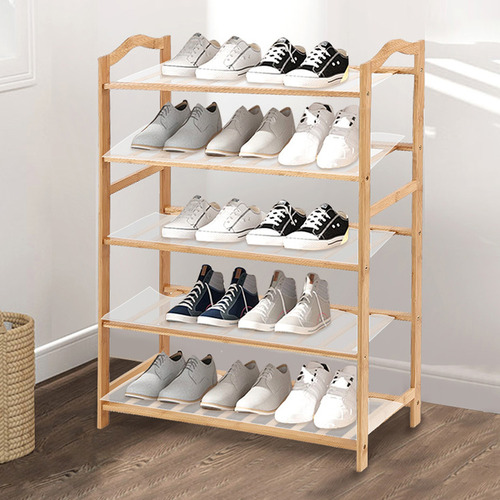
You are a GUI agent. You are given a task and a screenshot of the screen. Output one action in this format:
    pyautogui.click(x=<x>, y=<y>)
    Task: Click on the white shoes on a shelf
    
    Given the screenshot: What is the action you would take?
    pyautogui.click(x=333, y=397), pyautogui.click(x=298, y=399), pyautogui.click(x=238, y=209), pyautogui.click(x=202, y=208), pyautogui.click(x=297, y=140), pyautogui.click(x=334, y=145), pyautogui.click(x=242, y=56), pyautogui.click(x=191, y=55)